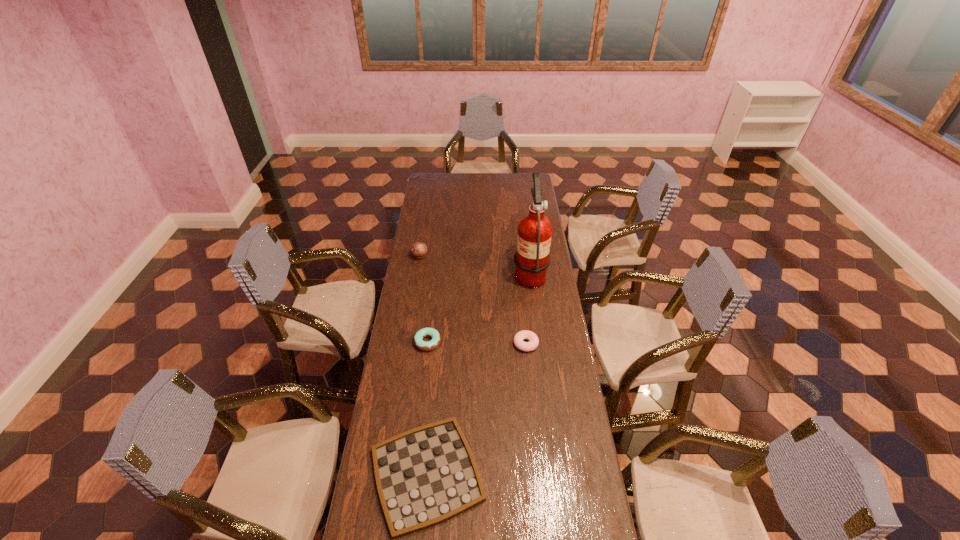
Find the location of a particular element. This screenshot has height=540, width=960. vacant position at the far right corner of the desktop is located at coordinates (521, 186).

I want to click on free spot between the left doughnut and the checkerboard, so click(x=427, y=408).

The height and width of the screenshot is (540, 960). In order to click on free space that is in between the tallest object and the right doughnut in this screenshot , I will do `click(528, 308)`.

Identify the location of free space between the left doughnut and the shortest object. The height and width of the screenshot is (540, 960). (427, 408).

Where is `vacant region between the checkerboard and the tallest object`? Image resolution: width=960 pixels, height=540 pixels. vacant region between the checkerboard and the tallest object is located at coordinates (478, 374).

You are a GUI agent. You are given a task and a screenshot of the screen. Output one action in this format:
    pyautogui.click(x=<x>, y=<y>)
    Task: Click on the unoccupied position between the right doughnut and the tallest object
    The height and width of the screenshot is (540, 960).
    Given the screenshot: What is the action you would take?
    pyautogui.click(x=528, y=308)

Identify the location of vacant space that's between the right doughnut and the left doughnut. (477, 343).

Find the location of `free space between the left doughnut and the right doughnut`. free space between the left doughnut and the right doughnut is located at coordinates (477, 343).

In order to click on unoccupied area between the muffin and the fire extinguisher in this screenshot , I will do `click(474, 265)`.

Image resolution: width=960 pixels, height=540 pixels. In order to click on vacant area between the fire extinguisher and the right doughnut in this screenshot , I will do `click(528, 308)`.